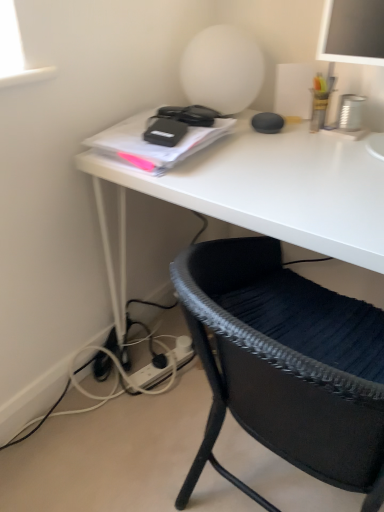
Question: Is black woven chair at lower right at the back of white matte desk at center?

Choices:
 (A) yes
 (B) no

Answer: (B)

Question: From the image's perspective, is white matte desk at center beneath black woven chair at lower right?

Choices:
 (A) yes
 (B) no

Answer: (B)

Question: From a real-world perspective, is white matte desk at center below black woven chair at lower right?

Choices:
 (A) no
 (B) yes

Answer: (A)

Question: Can you confirm if white matte desk at center is positioned to the left of black woven chair at lower right?

Choices:
 (A) no
 (B) yes

Answer: (B)

Question: Could black woven chair at lower right be considered to be inside white matte desk at center?

Choices:
 (A) yes
 (B) no

Answer: (A)

Question: Is black woven chair at lower right spatially inside white plastic plug at lower center, or outside of it?

Choices:
 (A) outside
 (B) inside

Answer: (A)

Question: In terms of width, does black woven chair at lower right look wider or thinner when compared to white plastic plug at lower center?

Choices:
 (A) wide
 (B) thin

Answer: (A)

Question: From their relative heights in the image, would you say black woven chair at lower right is taller or shorter than white plastic plug at lower center?

Choices:
 (A) tall
 (B) short

Answer: (A)

Question: Is point (233, 481) positioned closer to the camera than point (147, 386)?

Choices:
 (A) farther
 (B) closer

Answer: (B)

Question: Looking at their shapes, would you say white plastic plug at lower center is wider or thinner than black woven chair at lower right?

Choices:
 (A) thin
 (B) wide

Answer: (A)

Question: From the image's perspective, is white plastic plug at lower center above or below black woven chair at lower right?

Choices:
 (A) below
 (B) above

Answer: (A)

Question: Is white plastic plug at lower center situated inside black woven chair at lower right or outside?

Choices:
 (A) inside
 (B) outside

Answer: (B)

Question: Does point (144, 384) appear closer or farther from the camera than point (183, 502)?

Choices:
 (A) farther
 (B) closer

Answer: (A)

Question: In terms of size, does white plastic plug at lower center appear bigger or smaller than white matte desk at center?

Choices:
 (A) big
 (B) small

Answer: (B)

Question: Looking at their shapes, would you say white plastic plug at lower center is wider or thinner than white matte desk at center?

Choices:
 (A) wide
 (B) thin

Answer: (B)